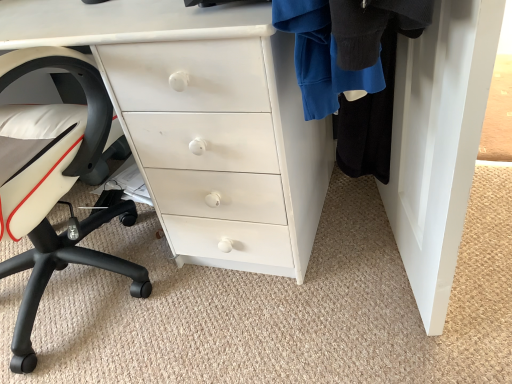
The height and width of the screenshot is (384, 512). What do you see at coordinates (51, 183) in the screenshot? I see `white matte chair at left` at bounding box center [51, 183].

This screenshot has width=512, height=384. I want to click on white matte chair at left, so click(x=51, y=183).

Measure the distance between white painted wood chest of drawers at center and camera.

white painted wood chest of drawers at center is 29.67 inches away from camera.

Describe the element at coordinates (203, 121) in the screenshot. The image size is (512, 384). I see `white painted wood chest of drawers at center` at that location.

Image resolution: width=512 pixels, height=384 pixels. I want to click on white painted wood chest of drawers at center, so click(203, 121).

Find the location of a particular element. Image resolution: width=512 pixels, height=384 pixels. white matte chair at left is located at coordinates (51, 183).

Considering the relative positions of white painted wood chest of drawers at center and white matte chair at left in the image provided, is white painted wood chest of drawers at center to the left of white matte chair at left from the viewer's perspective?

Incorrect, white painted wood chest of drawers at center is not on the left side of white matte chair at left.

Is white painted wood chest of drawers at center in front of or behind white matte chair at left in the image?

Visually, white painted wood chest of drawers at center is located behind white matte chair at left.

Does point (290, 184) lie behind point (40, 262)?

No, it is in front of (40, 262).

From the image's perspective, which one is positioned lower, white painted wood chest of drawers at center or white matte chair at left?

white matte chair at left is shown below in the image.

From a real-world perspective, who is located lower, white painted wood chest of drawers at center or white matte chair at left?

In real-world perspective, white painted wood chest of drawers at center is lower.

Can you confirm if white painted wood chest of drawers at center is wider than white matte chair at left?

Incorrect, the width of white painted wood chest of drawers at center does not surpass that of white matte chair at left.

Who is taller, white painted wood chest of drawers at center or white matte chair at left?

Standing taller between the two is white matte chair at left.

Between white painted wood chest of drawers at center and white matte chair at left, which one has larger size?

Bigger between the two is white painted wood chest of drawers at center.

Would you say white matte chair at left is part of white painted wood chest of drawers at center's contents?

Yes.

Can you see white painted wood chest of drawers at center touching white matte chair at left?

white painted wood chest of drawers at center and white matte chair at left are not in contact.

From the picture: Does white painted wood chest of drawers at center turn towards white matte chair at left?

Yes, white painted wood chest of drawers at center is facing white matte chair at left.

Based on the photo, how distant is white painted wood chest of drawers at center from white matte chair at left?

The distance of white painted wood chest of drawers at center from white matte chair at left is 10.93 inches.

You are a GUI agent. You are given a task and a screenshot of the screen. Output one action in this format:
    pyautogui.click(x=<x>, y=<y>)
    Task: Click on the chest of drawers that is above the white matte chair at left (from the image's perspective)
    The height and width of the screenshot is (384, 512).
    Given the screenshot: What is the action you would take?
    pyautogui.click(x=203, y=121)

Is white matte chair at left at the left side of white painted wood chest of drawers at center?

Correct, you'll find white matte chair at left to the left of white painted wood chest of drawers at center.

Is white matte chair at left positioned behind white painted wood chest of drawers at center?

That is False.

Does point (104, 121) appear closer or farther from the camera than point (268, 45)?

Point (104, 121) is farther from the camera than point (268, 45).

From the image's perspective, between white matte chair at left and white painted wood chest of drawers at center, which one is located above?

white painted wood chest of drawers at center.

From a real-world perspective, is white matte chair at left physically above white painted wood chest of drawers at center?

Yes, from a real-world perspective, white matte chair at left is over white painted wood chest of drawers at center

Can you confirm if white matte chair at left is thinner than white painted wood chest of drawers at center?

Incorrect, the width of white matte chair at left is not less than that of white painted wood chest of drawers at center.

From their relative heights in the image, would you say white matte chair at left is taller or shorter than white painted wood chest of drawers at center?

white matte chair at left is taller than white painted wood chest of drawers at center.

Considering the relative sizes of white matte chair at left and white painted wood chest of drawers at center in the image provided, is white matte chair at left smaller than white painted wood chest of drawers at center?

Indeed, white matte chair at left has a smaller size compared to white painted wood chest of drawers at center.

Can we say white matte chair at left lies outside white painted wood chest of drawers at center?

That's incorrect, white matte chair at left is not completely outside white painted wood chest of drawers at center.

Is there a large distance between white matte chair at left and white painted wood chest of drawers at center?

white matte chair at left is actually quite close to white painted wood chest of drawers at center.

Does white matte chair at left turn towards white painted wood chest of drawers at center?

Yes, white matte chair at left is turned towards white painted wood chest of drawers at center.

Can you tell me how much white matte chair at left and white painted wood chest of drawers at center differ in facing direction?

178 degrees.

This screenshot has height=384, width=512. I want to click on chair on the left of white painted wood chest of drawers at center, so click(x=51, y=183).

You are a GUI agent. You are given a task and a screenshot of the screen. Output one action in this format:
    pyautogui.click(x=<x>, y=<y>)
    Task: Click on the chest of drawers above the white matte chair at left (from the image's perspective)
    The height and width of the screenshot is (384, 512).
    Given the screenshot: What is the action you would take?
    pyautogui.click(x=203, y=121)

The height and width of the screenshot is (384, 512). Find the location of `chest of drawers that appears on the right of white matte chair at left`. chest of drawers that appears on the right of white matte chair at left is located at coordinates (203, 121).